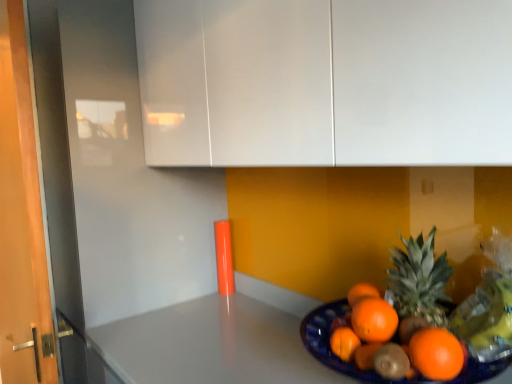
Question: From a real-world perspective, is white glossy cabinet at upper center physically located above or below blue glossy plate at lower right?

Choices:
 (A) above
 (B) below

Answer: (A)

Question: Visually, is white glossy cabinet at upper center positioned to the left or to the right of blue glossy plate at lower right?

Choices:
 (A) right
 (B) left

Answer: (B)

Question: Considering the positions of point (404, 124) and point (139, 382), is point (404, 124) closer or farther from the camera than point (139, 382)?

Choices:
 (A) farther
 (B) closer

Answer: (B)

Question: Is point (183, 334) closer or farther from the camera than point (209, 124)?

Choices:
 (A) closer
 (B) farther

Answer: (B)

Question: In terms of width, does blue glossy plate at lower right look wider or thinner when compared to white glossy cabinet at upper center?

Choices:
 (A) thin
 (B) wide

Answer: (A)

Question: From the image's perspective, is blue glossy plate at lower right above or below white glossy cabinet at upper center?

Choices:
 (A) below
 (B) above

Answer: (A)

Question: Visually, is blue glossy plate at lower right positioned to the left or to the right of white glossy cabinet at upper center?

Choices:
 (A) right
 (B) left

Answer: (A)